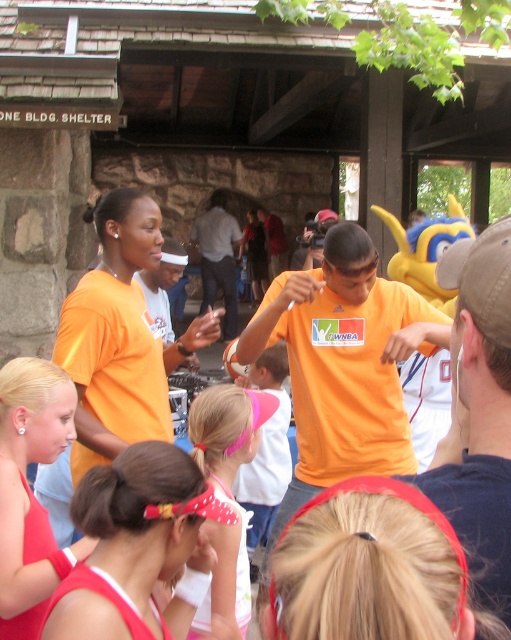
You are standing at the origin point in the image. Which direction should you move to reach the matte red swimsuit at lower left?

Since the matte red swimsuit at lower left is located at point 0.767 on the x axis and 0.061 on the y axis, you should move to the right and slightly downward to reach it.

You are a photographer standing at the edge of the event area. You want to capture a photo that includes both the matte red swimsuit at lower left and the pink fabric headband at center. What is the minimum distance you need to move backward to ensure both objects are in frame?

The matte red swimsuit at lower left is 25.53 inches away from the pink fabric headband at center. To include both in the frame, you need to move backward at least 25.53 inches so that the camera can capture the entire distance between them.